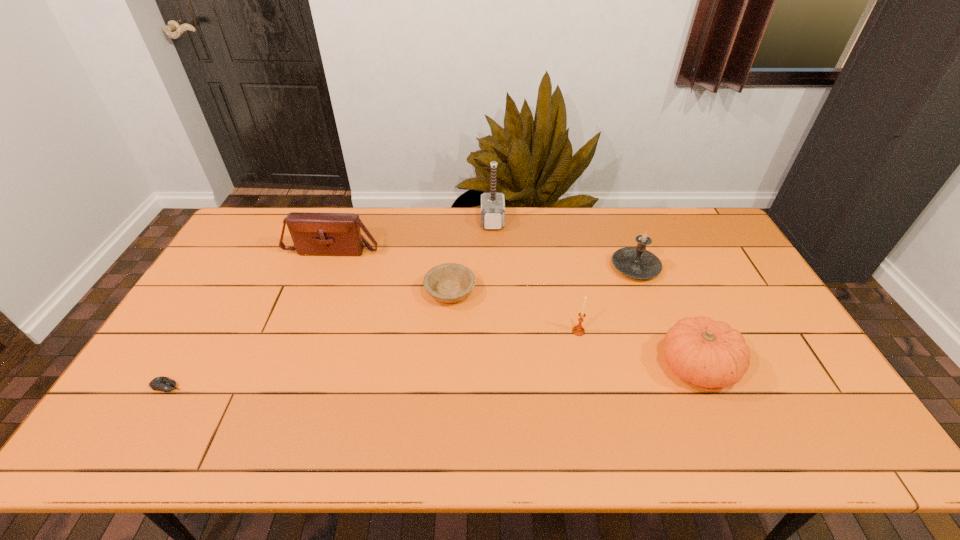
Identify the location of the leftmost object. click(161, 383).

At what (x,y) coordinates should I click in order to perform the action: click on free location located for striking with the head of the tallest object. Please return your answer as a coordinate pair (x, y). Looking at the image, I should click on (417, 221).

Locate an element on the screen. Image resolution: width=960 pixels, height=540 pixels. vacant region located 0.060m for striking with the head of the tallest object is located at coordinates (465, 221).

Locate an element on the screen. This screenshot has width=960, height=540. free space located for striking with the head of the tallest object is located at coordinates (468, 221).

The width and height of the screenshot is (960, 540). What are the coordinates of `blank space located on the front flap of the shoulder bag` in the screenshot? It's located at click(316, 295).

Identify the location of vacant space located on the right of the candle. Image resolution: width=960 pixels, height=540 pixels. (678, 267).

Locate an element on the screen. blank space located 0.200m on the back of the third nearest object is located at coordinates (567, 279).

Where is `free space located on the front of the pumpkin`? The image size is (960, 540). free space located on the front of the pumpkin is located at coordinates (725, 433).

The image size is (960, 540). I want to click on free space located 0.090m on the left of the second shortest object, so click(396, 292).

I want to click on vacant space situated on the right of the computer mouse, so click(270, 386).